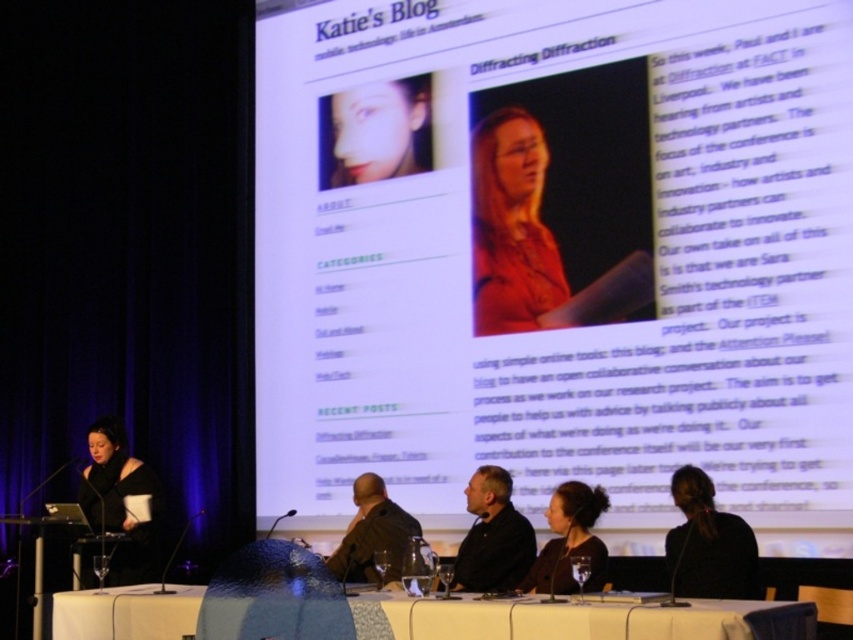
Question: Which point appears closest to the camera in this image?

Choices:
 (A) pos(459,566)
 (B) pos(497,317)
 (C) pos(665,435)

Answer: (A)

Question: Is white fabric table at lower center positioned before dark brown leather jacket at center?

Choices:
 (A) yes
 (B) no

Answer: (A)

Question: Which is nearer to the dark brown leather jacket at center?

Choices:
 (A) dark brown hair at center
 (B) dark brown hair at lower right

Answer: (A)

Question: Can you confirm if black matte dress at center is positioned to the right of dark gray shirt at center?

Choices:
 (A) no
 (B) yes

Answer: (A)

Question: Which point is farther to the camera?

Choices:
 (A) matte orange shirt at center
 (B) dark brown hair at center
 (C) dark brown leather jacket at center
 (D) white paper at upper center

Answer: (A)

Question: Does smooth skin face at upper center come behind dark brown leather jacket at center?

Choices:
 (A) no
 (B) yes

Answer: (B)